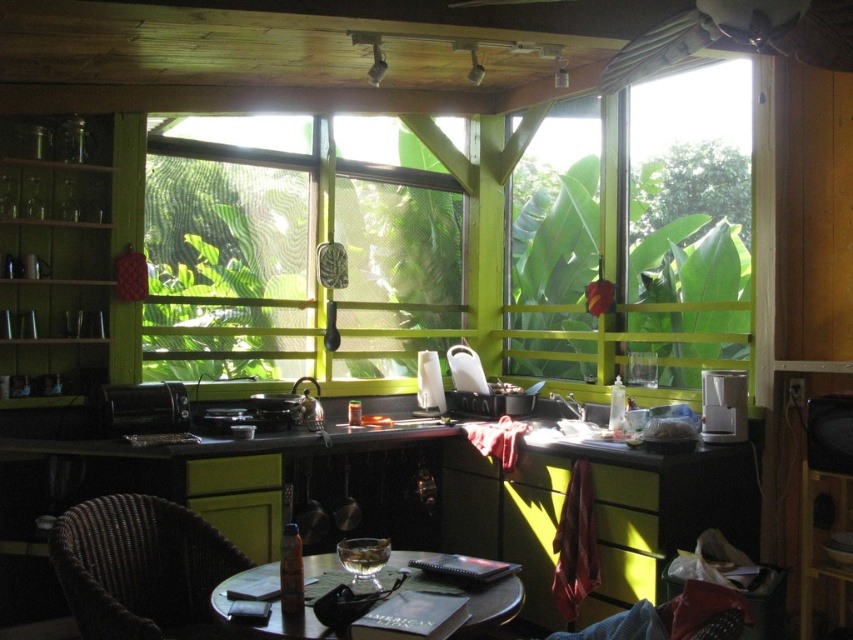
Question: Is clear plastic window at center thinner than green wooden window at center?

Choices:
 (A) no
 (B) yes

Answer: (A)

Question: Where is transparent plastic window at center located in relation to wooden round table at center in the image?

Choices:
 (A) above
 (B) below

Answer: (A)

Question: Is transparent plastic window at center positioned before wooden round table at center?

Choices:
 (A) no
 (B) yes

Answer: (A)

Question: Among these points, which one is farthest from the camera?

Choices:
 (A) (410, 348)
 (B) (178, 340)

Answer: (A)

Question: Among these points, which one is farthest from the camera?

Choices:
 (A) (187, 296)
 (B) (84, 508)
 (C) (492, 582)

Answer: (A)

Question: Among these points, which one is nearest to the camera?

Choices:
 (A) (364, 257)
 (B) (212, 620)
 (C) (384, 308)
 (D) (720, 170)

Answer: (B)